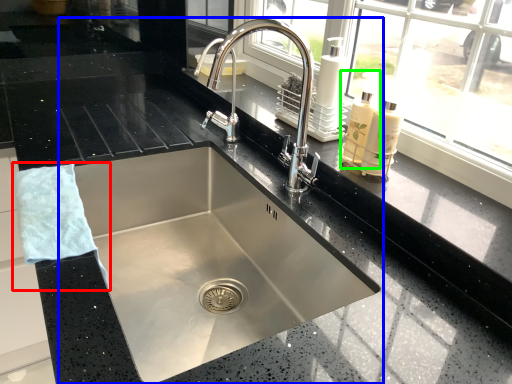
Question: Which object is the closest to the hand towel (highlighted by a red box)? Choose among these: sink (highlighted by a blue box) or soap dispenser (highlighted by a green box).

Choices:
 (A) sink
 (B) soap dispenser

Answer: (A)